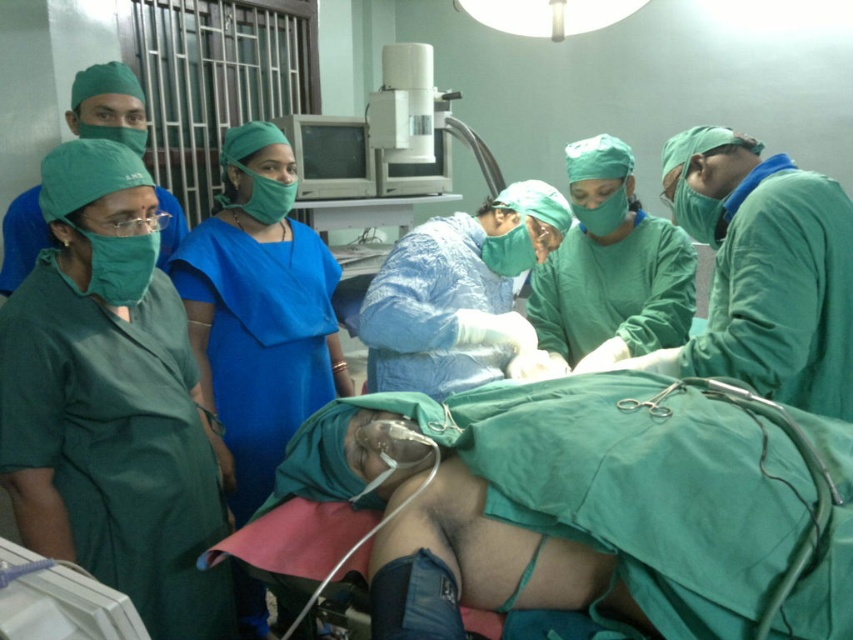
Based on the photo, you are a medical student observing a surgery. You notice the green fabric oxygen mask at center and the blue fabric dress at center. Based on their positions, which one is closer to you?

The green fabric oxygen mask at center is closer to you because it is in front of the blue fabric dress at center.

You are a surgeon in the operating room. You need to place a sterile drape between the two points marked as point (683,451) and point (256,468). Which point is closer to you so that you can reach it first without moving your position?

Point (683,451) is closer to the viewer than point (256,468), so you can reach it first without moving your position.

Looking at this image, you are a nurse in the operating room and need to locate the green fabric oxygen mask at center and the blue fabric dress at center. According to the scene, which item is positioned to the right of the other?

The green fabric oxygen mask at center is to the right of the blue fabric dress at center.